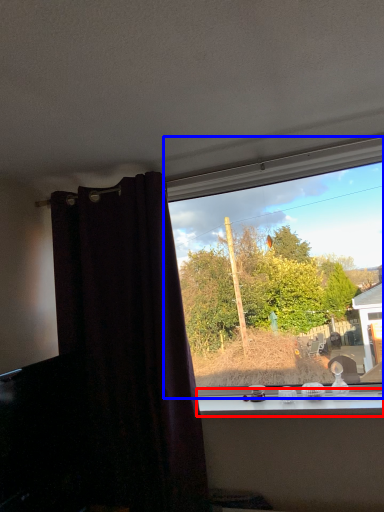
Question: Among these objects, which one is farthest to the camera, window sill (highlighted by a red box) or window (highlighted by a blue box)?

Choices:
 (A) window sill
 (B) window

Answer: (B)